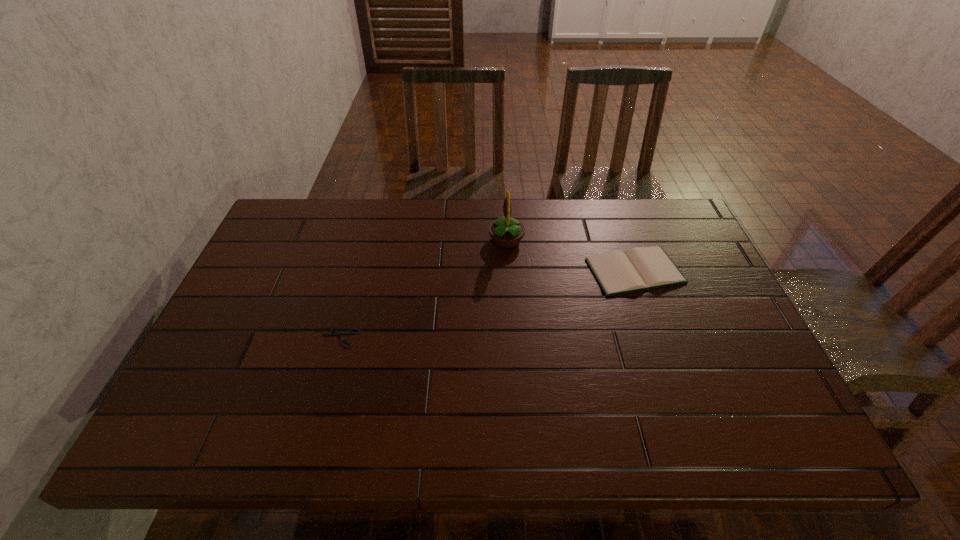
Identify the location of free space located 0.260m on the left of the nearest object. (215, 338).

Identify the location of object present at the far edge. Image resolution: width=960 pixels, height=540 pixels. (506, 232).

This screenshot has height=540, width=960. In order to click on object at the right edge in this screenshot , I will do `click(641, 268)`.

Where is `free location at the far edge of the desktop`? This screenshot has height=540, width=960. free location at the far edge of the desktop is located at coordinates (521, 222).

Where is `vacant space at the near edge of the desktop`? The height and width of the screenshot is (540, 960). vacant space at the near edge of the desktop is located at coordinates (515, 434).

The width and height of the screenshot is (960, 540). Identify the location of vacant space at the left edge. (255, 310).

I want to click on vacant space at the right edge of the desktop, so pyautogui.click(x=722, y=354).

Locate an element on the screen. This screenshot has width=960, height=540. free space at the far right corner of the desktop is located at coordinates (642, 214).

This screenshot has width=960, height=540. I want to click on free point between the tallest object and the rightmost object, so pos(570,255).

I want to click on vacant space that's between the leftmost object and the sunflower, so click(x=423, y=288).